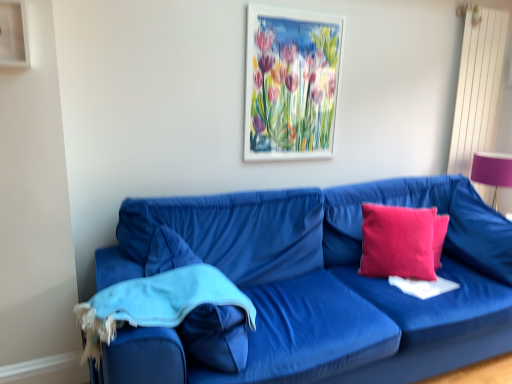
Question: Is white matte picture frame at upper center oriented towards velvet blue couch at lower left?

Choices:
 (A) yes
 (B) no

Answer: (B)

Question: Considering the relative sizes of white matte picture frame at upper center and velvet blue couch at lower left in the image provided, is white matte picture frame at upper center taller than velvet blue couch at lower left?

Choices:
 (A) yes
 (B) no

Answer: (B)

Question: From the image's perspective, is white matte picture frame at upper center below velvet blue couch at lower left?

Choices:
 (A) no
 (B) yes

Answer: (A)

Question: Does white matte picture frame at upper center have a smaller size compared to velvet blue couch at lower left?

Choices:
 (A) yes
 (B) no

Answer: (A)

Question: From the image's perspective, would you say white matte picture frame at upper center is positioned over velvet blue couch at lower left?

Choices:
 (A) no
 (B) yes

Answer: (B)

Question: Is white matte picture frame at upper center thinner than velvet blue couch at lower left?

Choices:
 (A) no
 (B) yes

Answer: (B)

Question: Considering the relative positions of pink velvet pillow at right, which ranks as the first pillow in left-to-right order, and pink fabric lampshade at right in the image provided, is pink velvet pillow at right, which ranks as the first pillow in left-to-right order, in front of pink fabric lampshade at right?

Choices:
 (A) no
 (B) yes

Answer: (B)

Question: Is pink velvet pillow at right, which ranks as the first pillow in left-to-right order, turned away from pink fabric lampshade at right?

Choices:
 (A) yes
 (B) no

Answer: (B)

Question: From a real-world perspective, is pink velvet pillow at right, marked as the second pillow in a right-to-left arrangement, positioned over pink fabric lampshade at right based on gravity?

Choices:
 (A) yes
 (B) no

Answer: (B)

Question: Does pink velvet pillow at right, which ranks as the first pillow in left-to-right order, contain pink fabric lampshade at right?

Choices:
 (A) yes
 (B) no

Answer: (B)

Question: Considering the relative positions of pink velvet pillow at right, marked as the second pillow in a right-to-left arrangement, and pink fabric lampshade at right in the image provided, is pink velvet pillow at right, marked as the second pillow in a right-to-left arrangement, to the right of pink fabric lampshade at right from the viewer's perspective?

Choices:
 (A) yes
 (B) no

Answer: (B)

Question: Does pink velvet pillow at right, which ranks as the first pillow in left-to-right order, have a larger size compared to pink fabric lampshade at right?

Choices:
 (A) yes
 (B) no

Answer: (B)

Question: Is velvet blue couch at lower left at the right side of pink fabric lampshade at right?

Choices:
 (A) no
 (B) yes

Answer: (A)